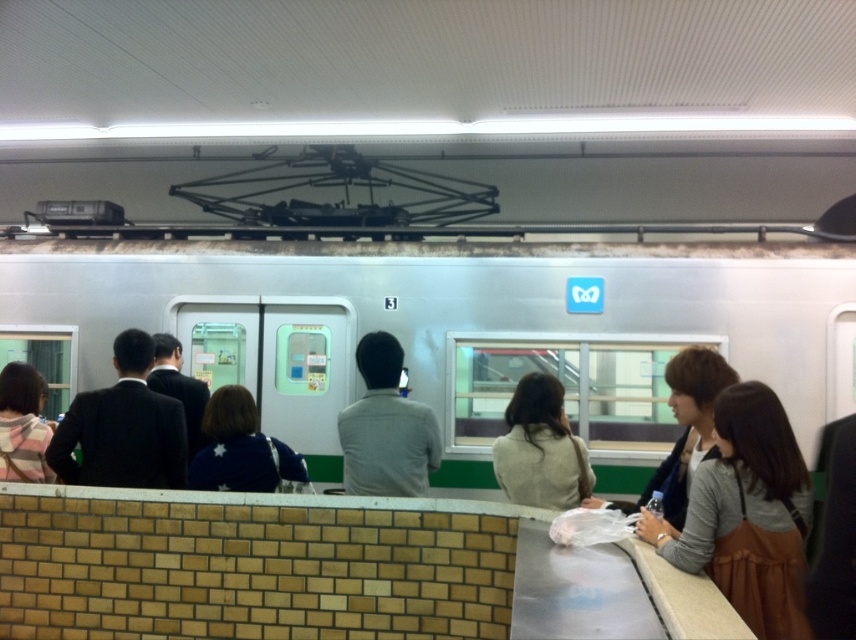
You are standing on the platform of the train station, and you see a person wearing a gray matte shirt at center. If you want to move towards them, which direction should you walk from your current position?

The gray matte shirt at center is located at coordinates approximately 0.669 on the x axis and 0.452 on the y axis. Since the exact direction depends on your starting position, but given the shirt is at the center of the scene, you should walk towards the central area of the platform where the shirt is positioned.

You are a passenger waiting for your train at the station. You have a brown leather bag at right and a blue knit sweater at center. Which item is nearer to you as you stand on the platform?

The brown leather bag at right is closer to the viewer than the blue knit sweater at center, so the bag is nearer to you.